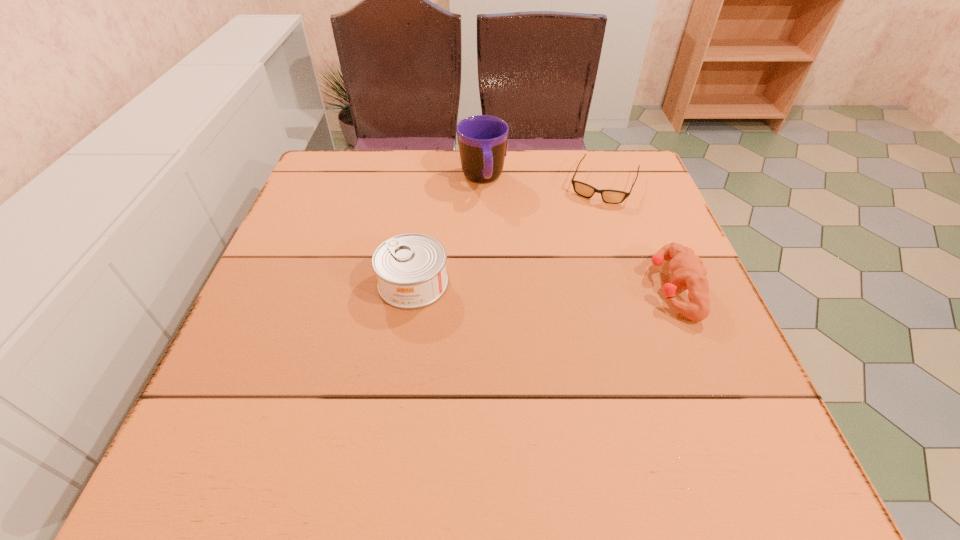
Find the location of a particular element. vacant space on the desktop that is between the can and the puncher and is positioned with the handle on the side of the tallest object is located at coordinates (507, 285).

What are the coordinates of `free space on the desktop that is between the can and the puncher and is positioned on the front-facing side of the sunglasses` in the screenshot? It's located at (562, 286).